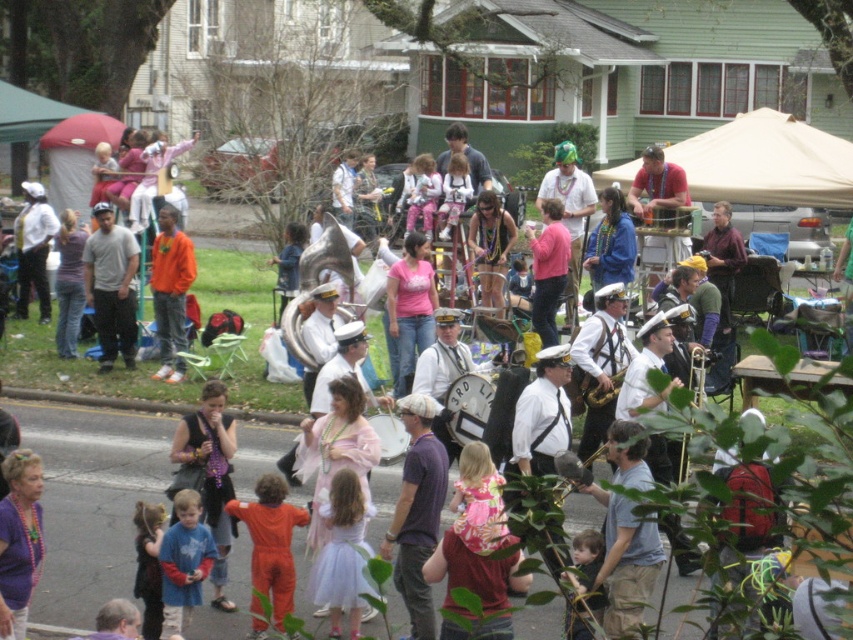
Question: Which point is closer to the camera taking this photo?

Choices:
 (A) (276, 612)
 (B) (561, 476)

Answer: (A)

Question: Which object is positioned closest to the beige fabric canopy at center?

Choices:
 (A) orange jumpsuit at center
 (B) gold brass trumpet at center
 (C) orange matte shirt at center

Answer: (C)

Question: Does beige fabric canopy at center come in front of light brown hair at lower center?

Choices:
 (A) yes
 (B) no

Answer: (B)

Question: Which object appears closest to the camera in this image?

Choices:
 (A) orange jumpsuit at center
 (B) light blue tulle dress at center
 (C) beige fabric canopy at center

Answer: (A)

Question: Does light brown hair at lower center appear over gold brass trumpet at center?

Choices:
 (A) yes
 (B) no

Answer: (B)

Question: Can you confirm if blue cotton shirt at center is smaller than orange matte shirt at center?

Choices:
 (A) no
 (B) yes

Answer: (B)